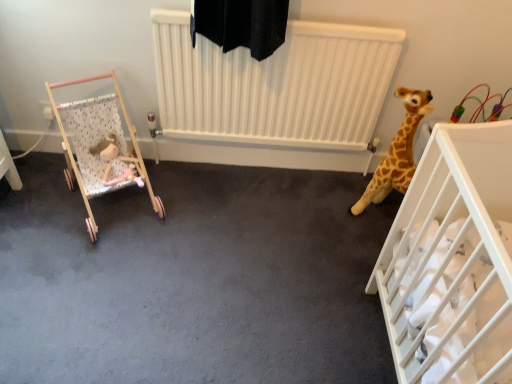
Question: Is white plastic crib at right, which is the first infant bed in right-to-left order, at the right side of fluffy pink plush at left?

Choices:
 (A) no
 (B) yes

Answer: (B)

Question: Does white plastic crib at right, which is the first infant bed in right-to-left order, have a greater width compared to fluffy pink plush at left?

Choices:
 (A) yes
 (B) no

Answer: (A)

Question: Does white plastic crib at right, which is counted as the 2th infant bed, starting from the left, have a lesser width compared to fluffy pink plush at left?

Choices:
 (A) no
 (B) yes

Answer: (A)

Question: From a real-world perspective, is white plastic crib at right, which is counted as the 2th infant bed, starting from the left, beneath fluffy pink plush at left?

Choices:
 (A) yes
 (B) no

Answer: (B)

Question: Is white plastic crib at right, which is counted as the 2th infant bed, starting from the left, oriented away from fluffy pink plush at left?

Choices:
 (A) no
 (B) yes

Answer: (A)

Question: Considering the relative sizes of white plastic crib at right, which is counted as the 2th infant bed, starting from the left, and fluffy pink plush at left in the image provided, is white plastic crib at right, which is counted as the 2th infant bed, starting from the left, bigger than fluffy pink plush at left?

Choices:
 (A) yes
 (B) no

Answer: (A)

Question: Does fluffy pink plush at left have a greater width compared to white plastic crib at right, which is the first infant bed in right-to-left order?

Choices:
 (A) no
 (B) yes

Answer: (A)

Question: Does fluffy pink plush at left have a smaller size compared to white plastic crib at right, which is counted as the 2th infant bed, starting from the left?

Choices:
 (A) no
 (B) yes

Answer: (B)

Question: Can you confirm if fluffy pink plush at left is positioned to the right of white plastic crib at right, which is the first infant bed in right-to-left order?

Choices:
 (A) no
 (B) yes

Answer: (A)

Question: Does fluffy pink plush at left have a lesser width compared to white plastic crib at right, which is counted as the 2th infant bed, starting from the left?

Choices:
 (A) no
 (B) yes

Answer: (B)

Question: From a real-world perspective, is fluffy pink plush at left below white plastic crib at right, which is counted as the 2th infant bed, starting from the left?

Choices:
 (A) yes
 (B) no

Answer: (A)

Question: Does fluffy pink plush at left appear on the left side of white plastic crib at right, which is counted as the 2th infant bed, starting from the left?

Choices:
 (A) no
 (B) yes

Answer: (B)

Question: From the image's perspective, is wooden stroller at left, arranged as the 2th infant bed when viewed from the right, above white plastic crib at right, which is the first infant bed in right-to-left order?

Choices:
 (A) no
 (B) yes

Answer: (B)